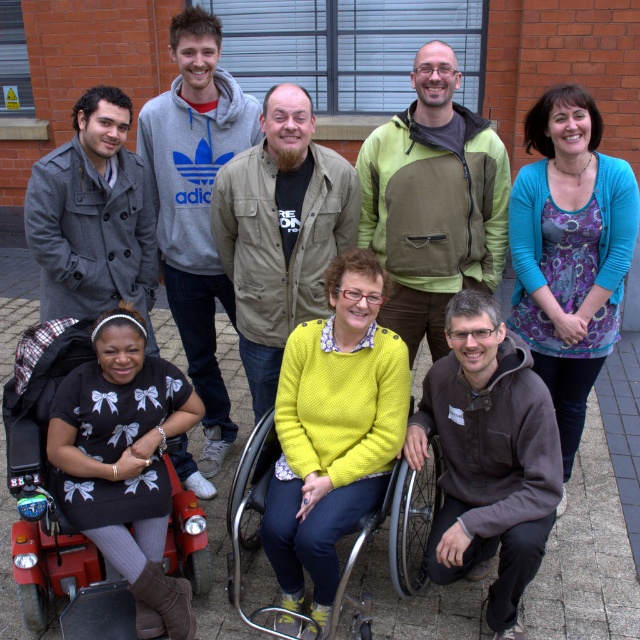
You are standing in the courtyard and see the grey hoodie at upper left and the gray woolen coat at left. Which one is positioned lower in the image?

The grey hoodie at upper left is positioned below the gray woolen coat at left, so the grey hoodie at upper left is lower in the image.

You are a photographer trying to capture a group photo of the knitted yellow sweater at center and the khaki jacket at center. Since you want to ensure both are fully visible, which clothing item requires a wider frame to accommodate its size?

The khaki jacket at center requires a wider frame because its width is greater than the knitted yellow sweater at center.

You are a photographer trying to capture a group photo of the eight individuals in the scene. You notice the green olive jacket at center and the metallic silver wheelchair at center. Which object should you move to the left to ensure the wheelchair is centered in the photo?

The green olive jacket at center should be moved to the left to ensure the metallic silver wheelchair at center is centered in the photo since the jacket is currently on the right side of the wheelchair.